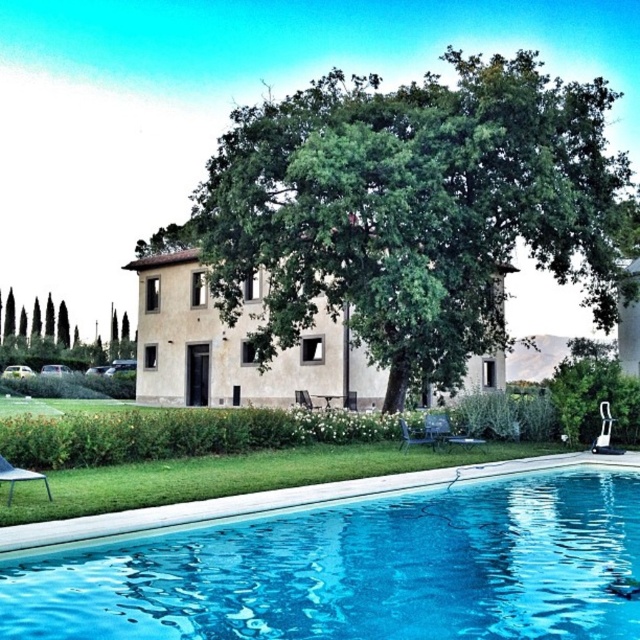
Is blue glassy swimming pool at lower center to the left of beige stucco villa at center from the viewer's perspective?

Incorrect, blue glassy swimming pool at lower center is not on the left side of beige stucco villa at center.

Which is behind, point (461, 492) or point (224, 381)?

Point (224, 381)

Between point (608, 563) and point (262, 392), which one is positioned in front?

Point (608, 563) is more forward.

The width and height of the screenshot is (640, 640). Identify the location of blue glassy swimming pool at lower center. (358, 570).

Does blue glassy swimming pool at lower center have a larger size compared to green leafy tree at left?

No.

Looking at this image, does blue glassy swimming pool at lower center appear over green leafy tree at left?

Incorrect, blue glassy swimming pool at lower center is not positioned above green leafy tree at left.

The image size is (640, 640). What are the coordinates of `blue glassy swimming pool at lower center` in the screenshot? It's located at (358, 570).

Who is positioned more to the left, green leafy tree at center or beige stucco villa at center?

From the viewer's perspective, beige stucco villa at center appears more on the left side.

Does green leafy tree at center have a lesser height compared to beige stucco villa at center?

No.

Is point (208, 179) positioned before point (310, 362)?

No, (208, 179) is behind (310, 362).

The width and height of the screenshot is (640, 640). What are the coordinates of `green leafy tree at center` in the screenshot? It's located at point(412,209).